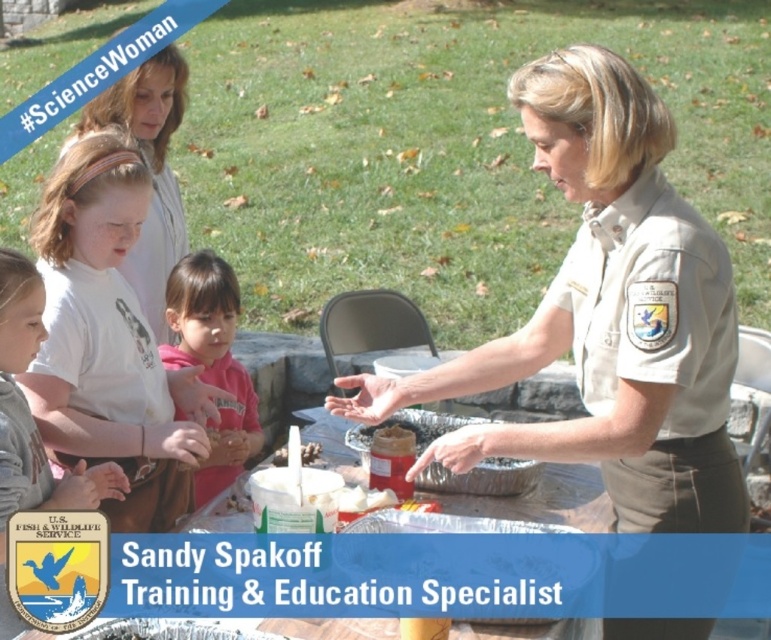
From the picture: Who is more distant from viewer, [197,396] or [389,426]?

The point [197,396] is behind.

What do you see at coordinates (109, 340) in the screenshot? This screenshot has height=640, width=771. I see `light brown hair at center` at bounding box center [109, 340].

Where is `light brown hair at center`? light brown hair at center is located at coordinates (109, 340).

Which is in front, point (130, 256) or point (386, 452)?

Positioned in front is point (386, 452).

Between matte white shirt at upper left and matte brown container at center, which one has less height?

With less height is matte brown container at center.

You are a GUI agent. You are given a task and a screenshot of the screen. Output one action in this format:
    pyautogui.click(x=<x>, y=<y>)
    Task: Click on the matte white shirt at upper left
    
    Given the screenshot: What is the action you would take?
    pyautogui.click(x=150, y=170)

From the picture: Who is more distant from viewer, (588, 224) or (386, 452)?

Positioned behind is point (386, 452).

Which is in front, point (738, 470) or point (386, 452)?

Point (738, 470) is in front.

Locate an element on the screen. satin tan uniform at center is located at coordinates tap(608, 316).